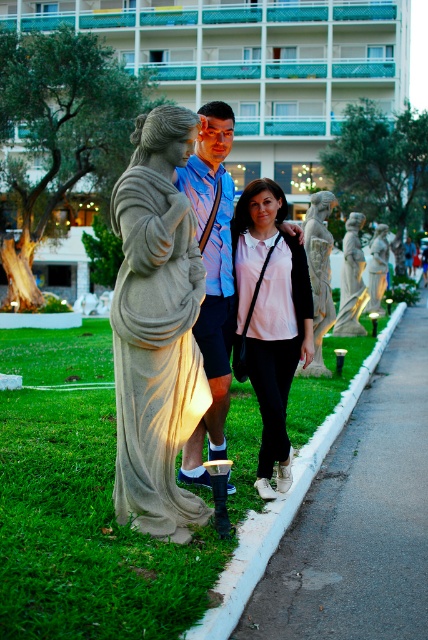
Based on the photo, you are a photographer trying to capture the stone statue at center and the matte gray statue at center in a single shot. Based on their positions, which statue is positioned to the left side of the other?

The stone statue at center is to the left of the matte gray statue at center.

You are standing in the park and see the matte pink shirt at center. If you want to take a closer look, how many steps do you estimate you need to take to reach it?

The matte pink shirt at center is 5.55 meters away from viewer. Assuming an average step length of about 0.75 meters, you would need to take approximately 7 to 8 steps to reach it.

You are a photographer trying to capture a wide shot of both the white marble statue at center and the matte gray statue at center. Given their widths, which statue would require you to step back more to include its entire width in the frame?

The matte gray statue at center has a wider width than the white marble statue at center, so you would need to step back more to include its entire width in the frame.